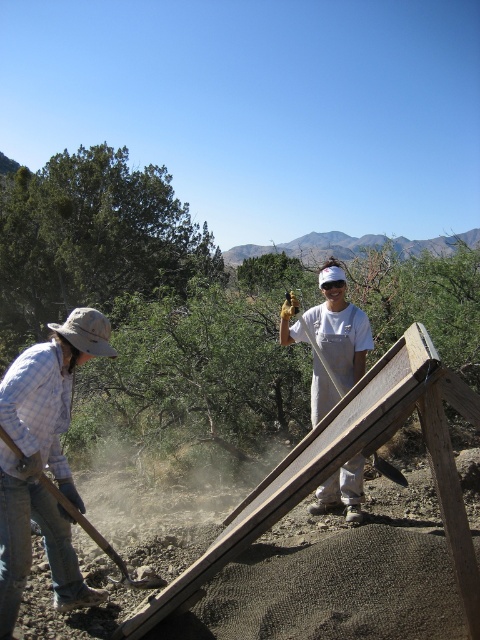
Question: Which point appears farthest from the camera in this image?

Choices:
 (A) (322, 364)
 (B) (59, 332)
 (C) (99, 547)

Answer: (A)

Question: Does plaid cotton shirt at lower left appear on the right side of wooden handle shovel at lower left?

Choices:
 (A) yes
 (B) no

Answer: (B)

Question: Which point appears closest to the camera in this image?

Choices:
 (A) click(x=96, y=330)
 (B) click(x=374, y=454)
 (C) click(x=127, y=570)

Answer: (A)

Question: Considering the real-world distances, which object is closest to the wooden handle shovel at lower left?

Choices:
 (A) plaid cotton shirt at lower left
 (B) wooden shovel at center

Answer: (A)

Question: Observing the image, what is the correct spatial positioning of plaid cotton shirt at lower left in reference to wooden shovel at center?

Choices:
 (A) left
 (B) right

Answer: (A)

Question: Is plaid cotton shirt at lower left bigger than wooden shovel at center?

Choices:
 (A) yes
 (B) no

Answer: (A)